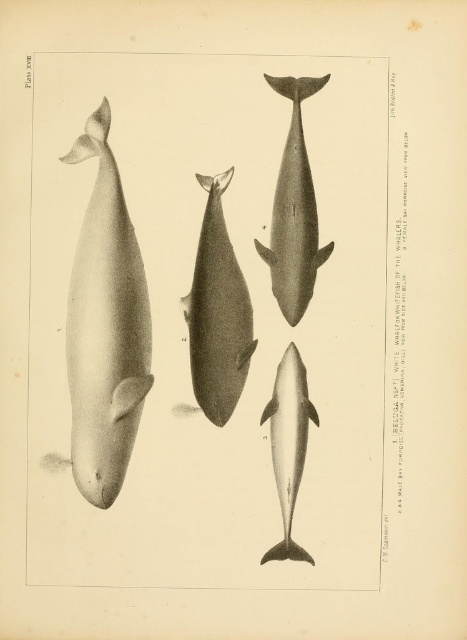
Question: Which is farther from the smooth gray dolphin at center?

Choices:
 (A) smooth gray whale at upper center
 (B) smooth gray whale at left

Answer: (B)

Question: Which point is farther to the camera?

Choices:
 (A) (91, 468)
 (B) (290, 234)
 (C) (284, 529)
 (D) (195, 369)

Answer: (D)

Question: Is smooth gray whale at upper center smaller than smooth gray dolphin at center?

Choices:
 (A) no
 (B) yes

Answer: (A)

Question: Which point appears closest to the camera in this image?

Choices:
 (A) (285, 179)
 (B) (87, 371)
 (C) (276, 449)

Answer: (B)

Question: In this image, where is smooth gray whale at center located relative to smooth gray whale at upper center?

Choices:
 (A) below
 (B) above

Answer: (A)

Question: Does smooth gray whale at left appear under smooth gray whale at center?

Choices:
 (A) yes
 (B) no

Answer: (A)